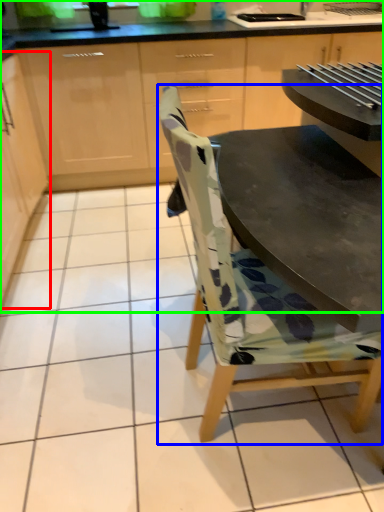
Question: Estimate the real-world distances between objects in this image. Which object is farther from cabinetry (highlighted by a red box), chair (highlighted by a blue box) or cabinetry (highlighted by a green box)?

Choices:
 (A) chair
 (B) cabinetry

Answer: (A)